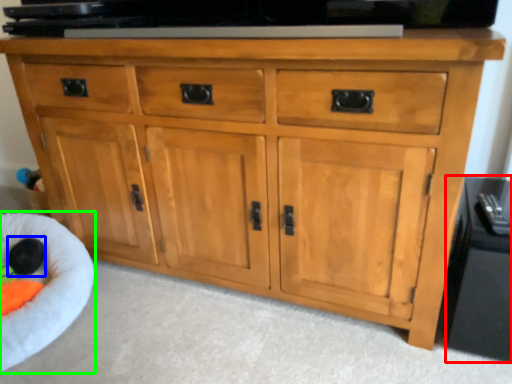
Question: Considering the real-world distances, which object is closest to side cabinet (highlighted by a red box)? toy (highlighted by a blue box) or infant bed (highlighted by a green box).

Choices:
 (A) toy
 (B) infant bed

Answer: (B)